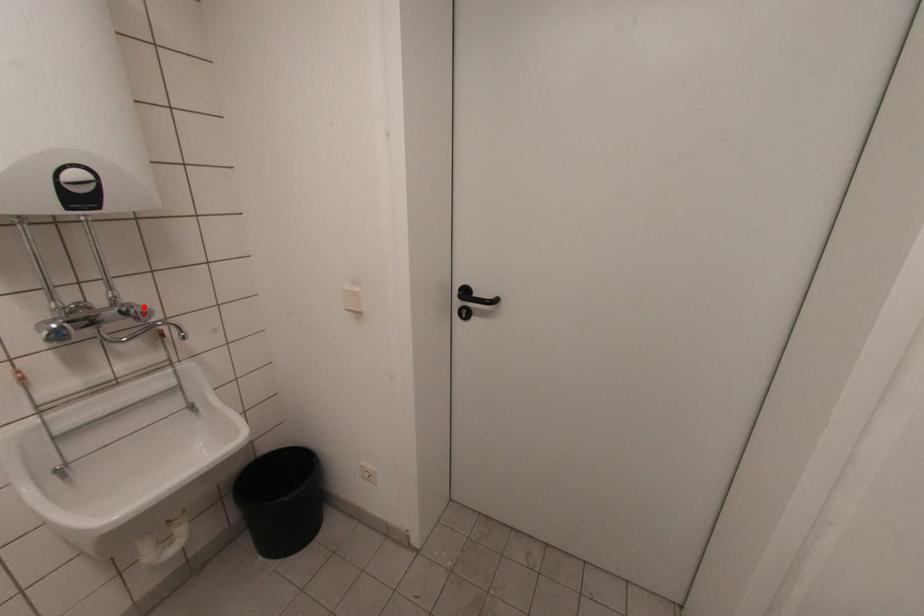
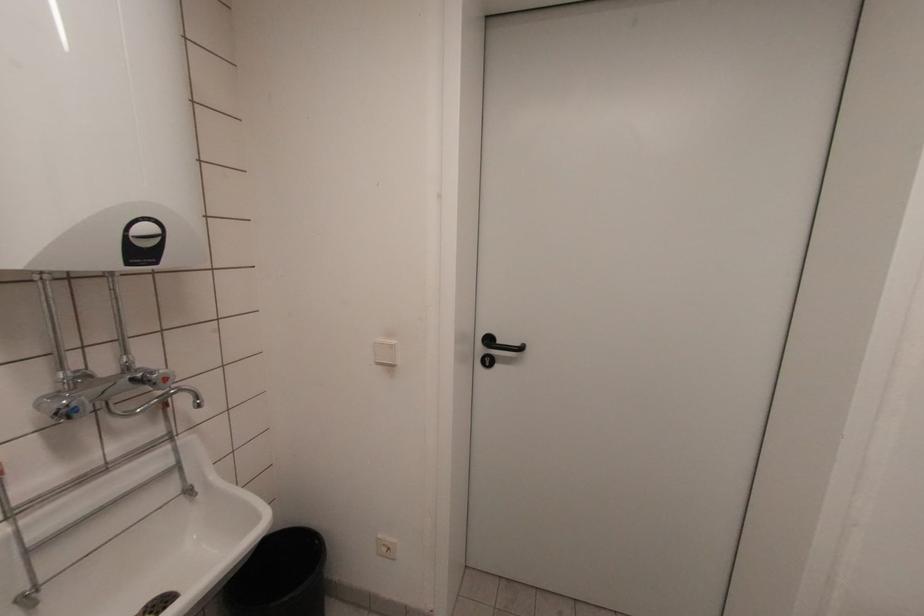
In the second image, find the point that corresponds to the highlighted location in the first image.

(163, 371)